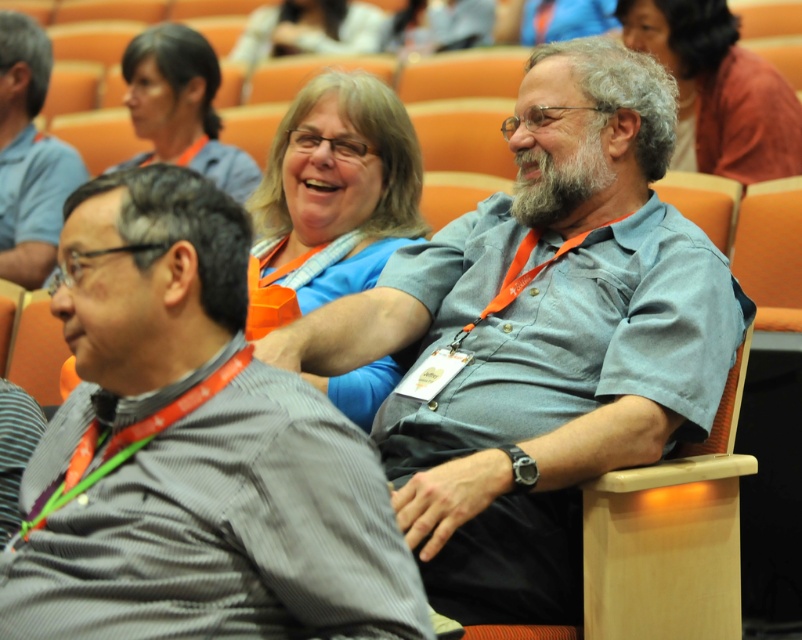
You are standing in the auditorium and want to move from point A to point B. Point A is located at coordinates point [25,108] and point B is at point [290,12]. Which point is closer to you when you start your journey?

Point [25,108] is closer to the viewer than point [290,12], so starting at point A would mean you are already closer to your starting position.

You are sitting in the auditorium and need to hand a document to both the gray cotton shirt at center and the blue fabric shirt at center. Which one should you approach first if you want to reach the one closer to the front of the room?

The gray cotton shirt at center is below the blue fabric shirt at center, meaning it is closer to the front. Therefore, you should approach the gray cotton shirt at center first.

Based on the scene description, where is the blue fabric shirt at center located in terms of coordinates?

The blue fabric shirt at center is located at point (333, 196).